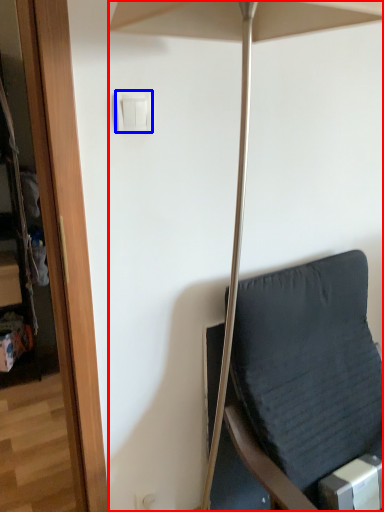
Question: Which object is further to the camera taking this photo, umbrella (highlighted by a red box) or light switch (highlighted by a blue box)?

Choices:
 (A) umbrella
 (B) light switch

Answer: (B)